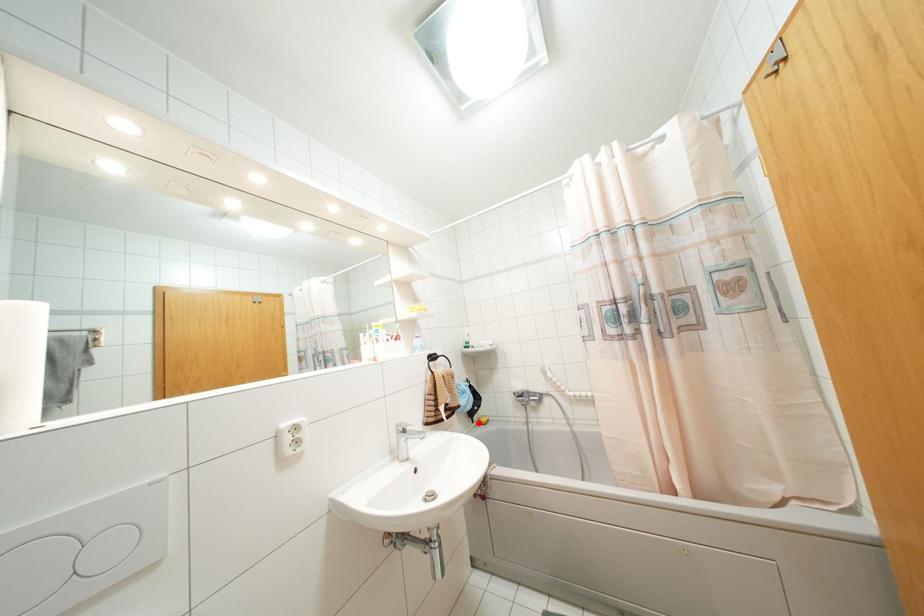
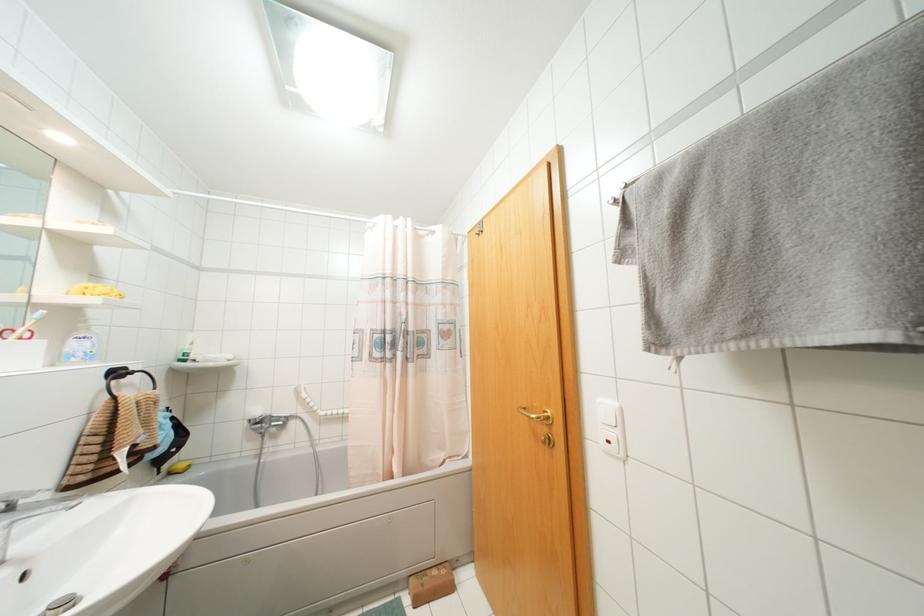
Question: I am providing you with two images of the same scene from different viewpoints. In image1, a red point is highlighted. Considering the same 3D point in image2, which of the following is correct?

Choices:
 (A) It is closer
 (B) It is farther

Answer: (A)